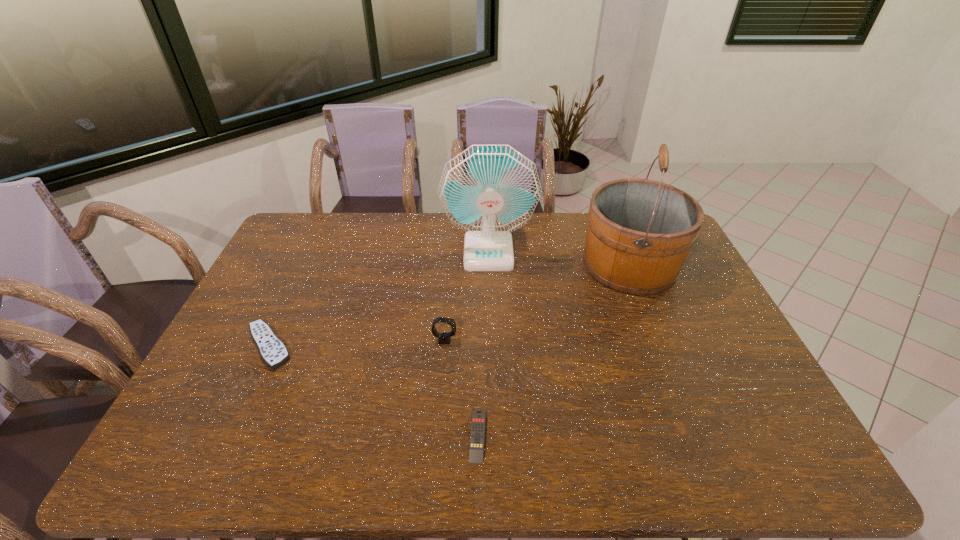
Find the location of a particular element. The height and width of the screenshot is (540, 960). vacant area between the fan and the shorter remote control is located at coordinates (483, 343).

The height and width of the screenshot is (540, 960). I want to click on vacant area that lies between the right remote control and the taller remote control, so click(x=373, y=390).

Where is `object that stands as the fourth closest to the shorter remote control`? The image size is (960, 540). object that stands as the fourth closest to the shorter remote control is located at coordinates (489, 191).

Choose which object is the third nearest neighbor to the watch. Please provide its 2D coordinates. Your answer should be formatted as a tuple, i.e. [(x, y)], where the tuple contains the x and y coordinates of a point satisfying the conditions above.

[(273, 351)]

The width and height of the screenshot is (960, 540). Find the location of `free space in the image that satisfies the following two spatial constraints: 1. on the back side of the shortest object; 2. on the left side of the bucket`. free space in the image that satisfies the following two spatial constraints: 1. on the back side of the shortest object; 2. on the left side of the bucket is located at coordinates (478, 265).

Locate an element on the screen. This screenshot has height=540, width=960. free spot that satisfies the following two spatial constraints: 1. on the face of the right remote control; 2. on the right side of the watch is located at coordinates (438, 435).

Where is `vacant space that satisfies the following two spatial constraints: 1. in front of the fan to face the airflow; 2. on the face of the third shortest object`? vacant space that satisfies the following two spatial constraints: 1. in front of the fan to face the airflow; 2. on the face of the third shortest object is located at coordinates (491, 340).

The width and height of the screenshot is (960, 540). What are the coordinates of `vacant space that satisfies the following two spatial constraints: 1. on the face of the nearer remote control; 2. on the right side of the third tallest object` in the screenshot? It's located at (438, 435).